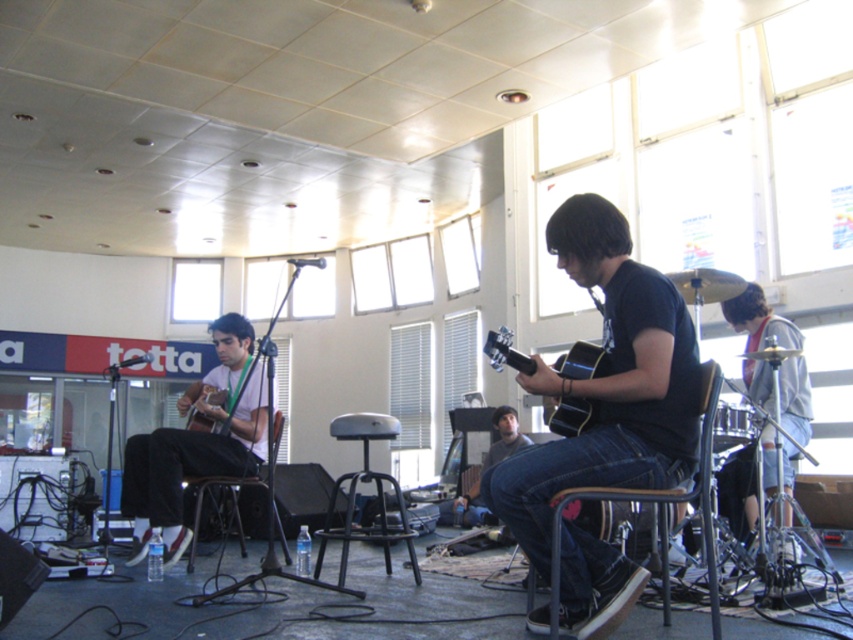
You are standing in the venue and want to locate the matte white shirt at center. According to the coordinates provided, where should you look relative to the guitarist and the other musician?

The matte white shirt at center is located at coordinates point (196,442), which places it centrally in the image. Since the guitarist is on the left and the other musician is in the center, the matte white shirt at center is positioned between them or slightly to the right of the central musician.